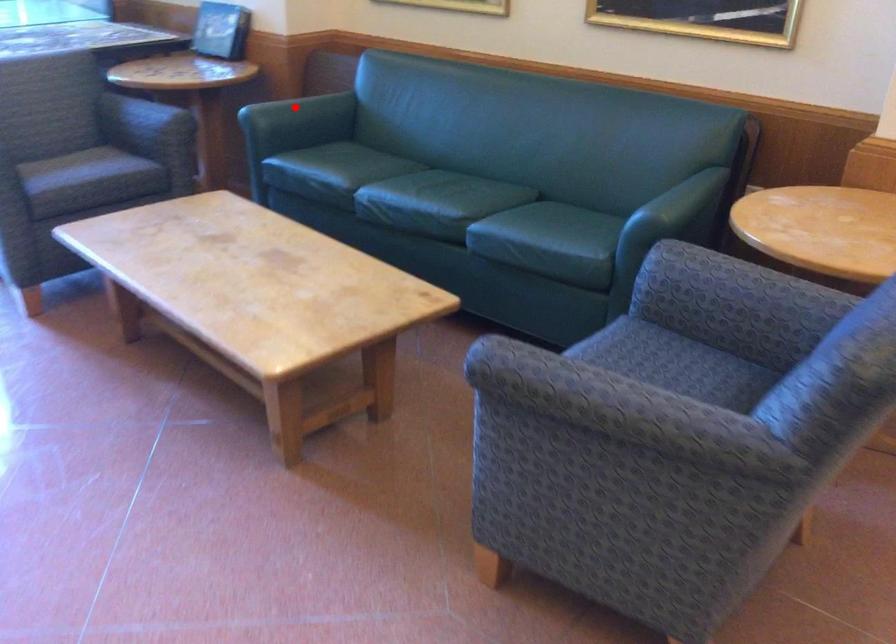
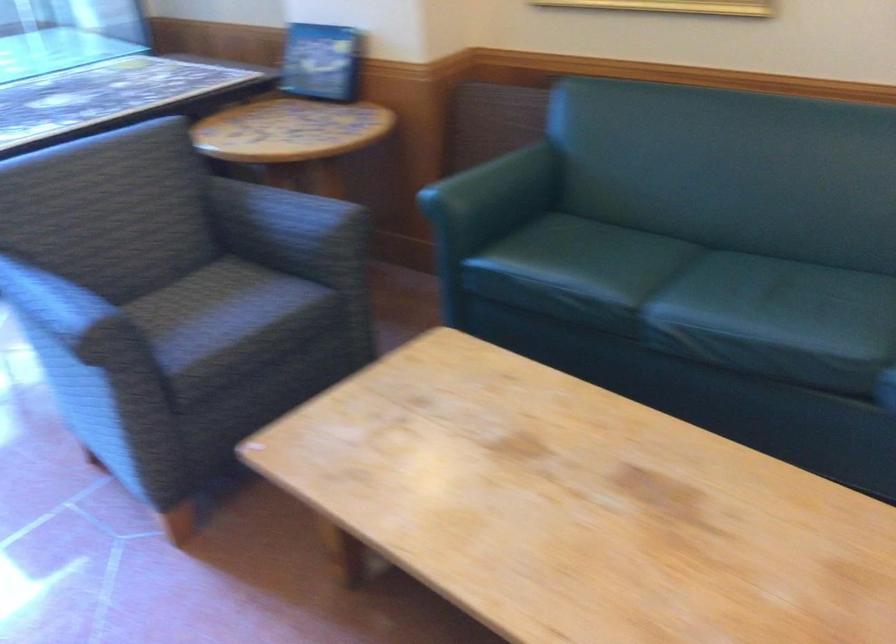
The point at the highlighted location is marked in the first image. Where is the corresponding point in the second image?

(496, 182)